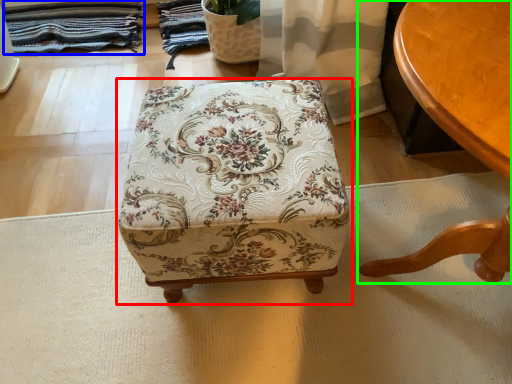
Question: Which object is positioned farthest from furniture (highlighted by a red box)? Select from blanket (highlighted by a blue box) and table (highlighted by a green box).

Choices:
 (A) blanket
 (B) table

Answer: (A)